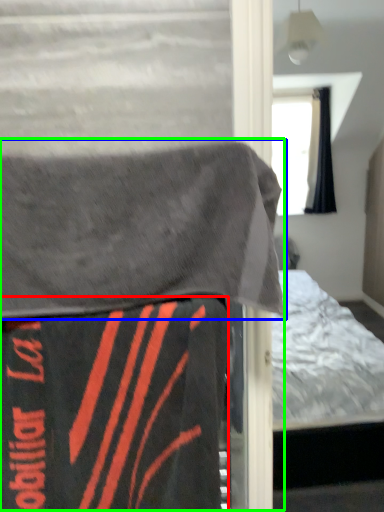
Question: Based on their relative distances, which object is nearer to blanket (highlighted by a red box)? Choose from blanket (highlighted by a blue box) and bed (highlighted by a green box).

Choices:
 (A) blanket
 (B) bed

Answer: (B)